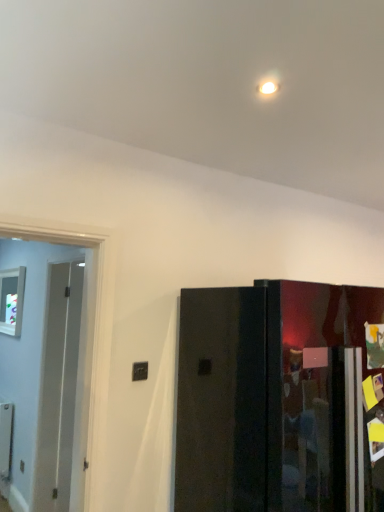
Question: Is point (355, 344) positioned closer to the camera than point (4, 332)?

Choices:
 (A) closer
 (B) farther

Answer: (A)

Question: Is glossy black refrigerator at right, which is the 1th door from right to left, bigger or smaller than transparent glass window at left?

Choices:
 (A) small
 (B) big

Answer: (B)

Question: Which object is the closest to the glossy black refrigerator at right, which is the 1th door from right to left?

Choices:
 (A) white glossy door at left, the second door in the right-to-left sequence
 (B) transparent glass window at left

Answer: (A)

Question: Based on their relative distances, which object is farther from the transparent glass window at left?

Choices:
 (A) white glossy door at left, the second door in the right-to-left sequence
 (B) glossy black refrigerator at right, the 2th door in the left-to-right sequence

Answer: (B)